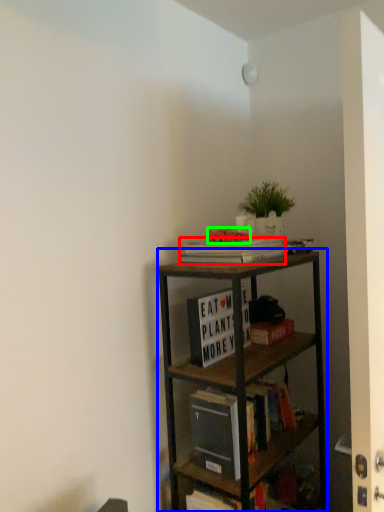
Question: Considering the real-world distances, which object is farthest from book (highlighted by a red box)? shelf (highlighted by a blue box) or toy (highlighted by a green box)?

Choices:
 (A) shelf
 (B) toy

Answer: (A)